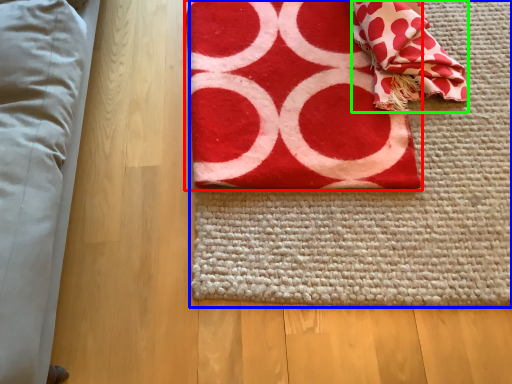
Question: Which object is positioned closest to towel (highlighted by a red box)? Select from yoga mat (highlighted by a blue box) and blanket (highlighted by a green box).

Choices:
 (A) yoga mat
 (B) blanket

Answer: (A)